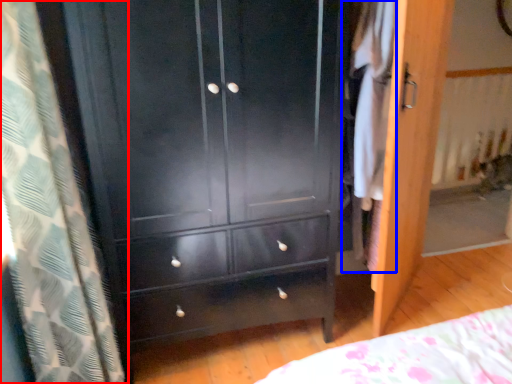
Question: Which point is further to the camera, curtain (highlighted by a red box) or clothing (highlighted by a blue box)?

Choices:
 (A) curtain
 (B) clothing

Answer: (B)